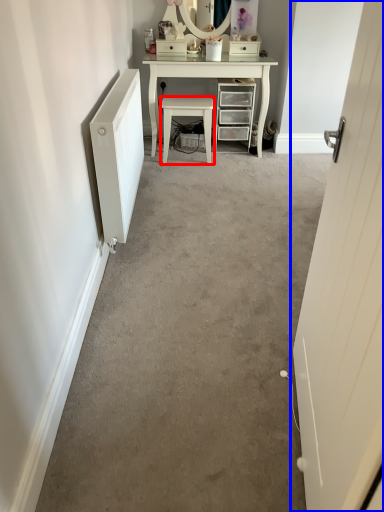
Question: Which object appears farthest to the camera in this image, stool (highlighted by a red box) or door (highlighted by a blue box)?

Choices:
 (A) stool
 (B) door

Answer: (A)